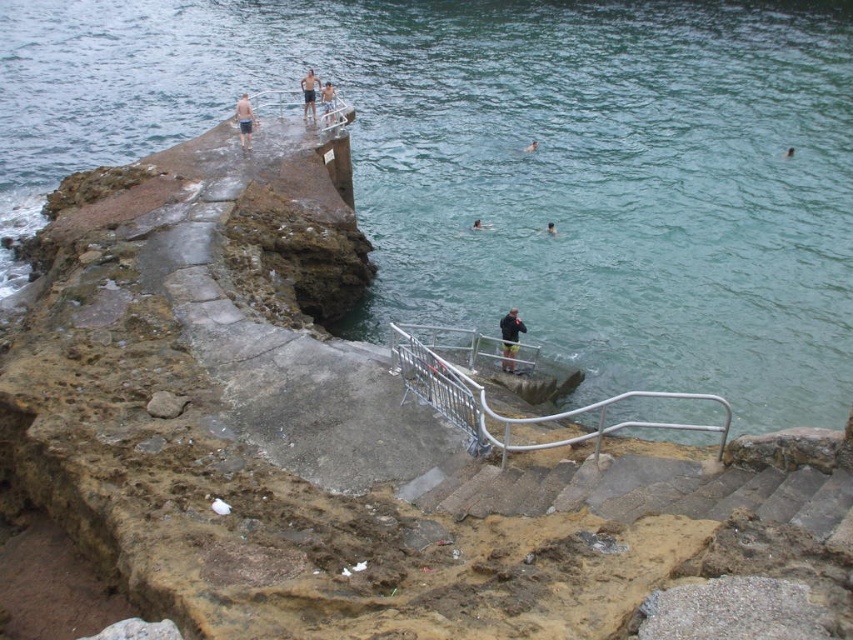
You are a person standing on the platform and want to reach the smooth skin person at center. The silver metallic rail at center is in your way. Can you walk around it? Please explain why.

The silver metallic rail at center is 57.13 feet away from the smooth skin person at center. Since the rail is at the center, you can walk around it either to the left or right side to reach the person without obstruction.